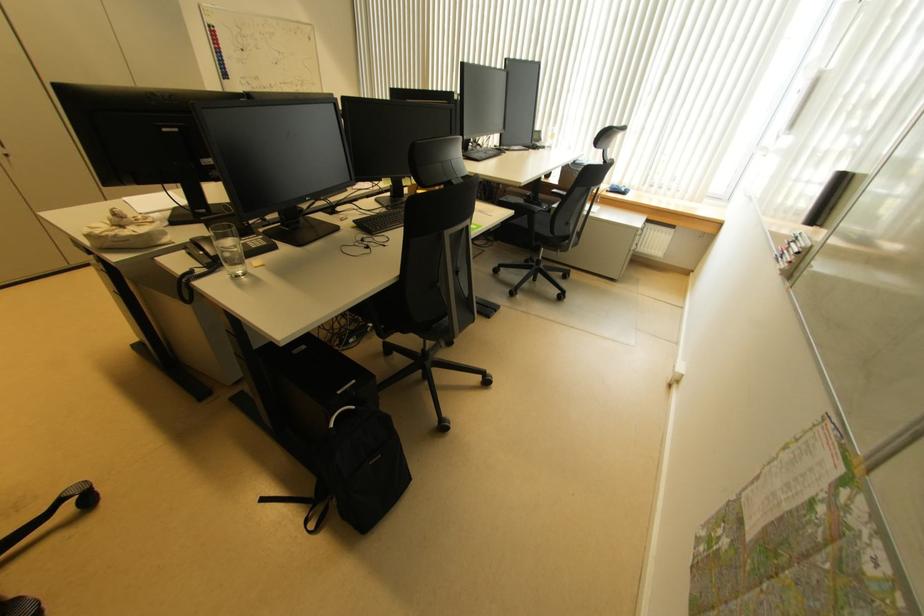
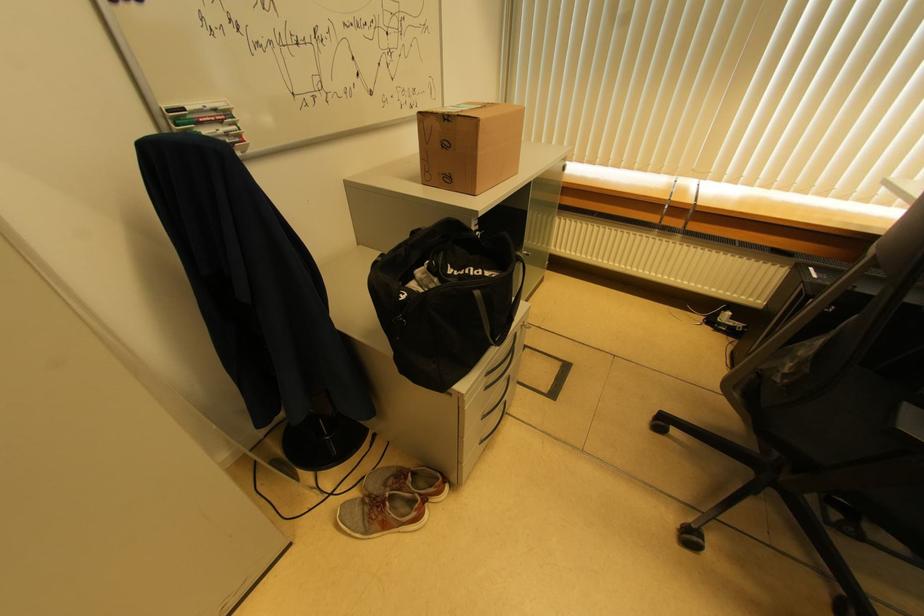
The images are taken continuously from a first-person perspective. In which direction are you moving?

The cameraman walked toward left, forward.